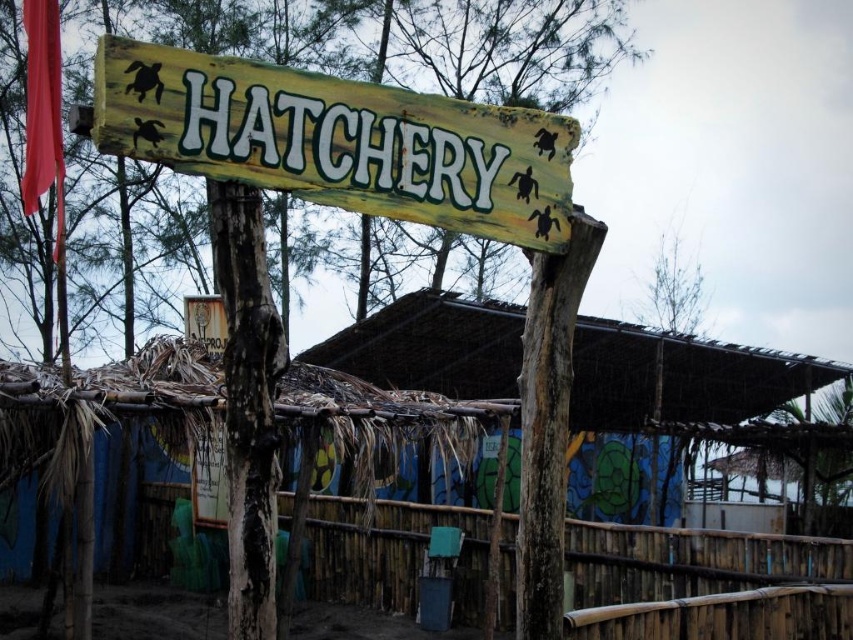
Question: Is wooden signboard at center below bamboo fence at lower center?

Choices:
 (A) yes
 (B) no

Answer: (B)

Question: Which is nearer to the bamboo fence at lower center?

Choices:
 (A) thatched roof hut at center
 (B) black rough wood pole at center
 (C) wooden signboard at center

Answer: (B)

Question: Which is nearer to the thatched roof hut at center?

Choices:
 (A) black rough wood pole at center
 (B) bamboo fence at lower center
 (C) wooden signboard at center

Answer: (B)

Question: Can you confirm if wooden signboard at center is positioned to the left of thatched roof hut at center?

Choices:
 (A) no
 (B) yes

Answer: (B)

Question: Does wooden signboard at center appear under thatched roof hut at center?

Choices:
 (A) yes
 (B) no

Answer: (B)

Question: Which is nearer to the black rough wood pole at center?

Choices:
 (A) wooden signboard at center
 (B) thatched roof hut at center
 (C) bamboo fence at lower center

Answer: (A)